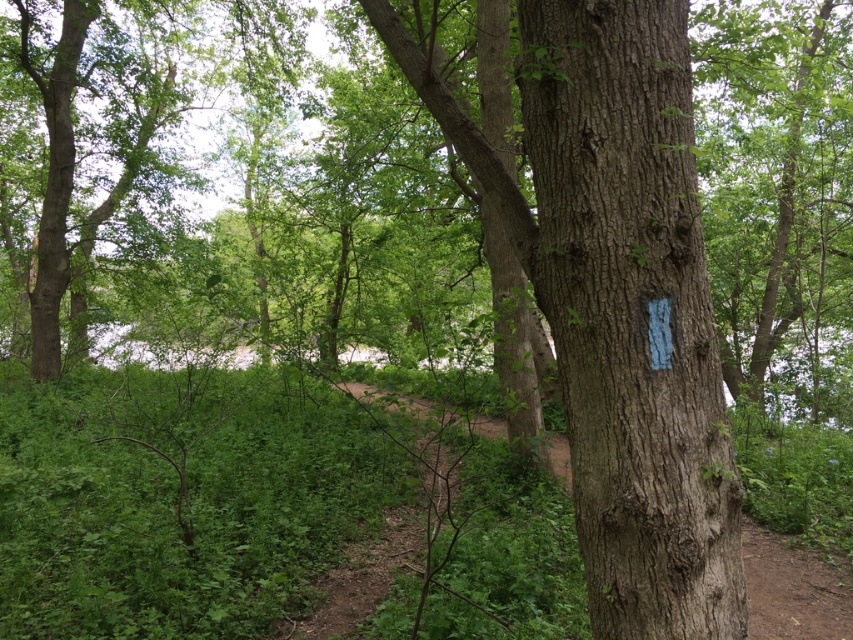
Measure the distance from smooth bark tree trunk at center to smooth bark tree at center.

smooth bark tree trunk at center is 7.58 meters away from smooth bark tree at center.

Who is higher up, smooth bark tree trunk at center or smooth bark tree at center?

smooth bark tree at center is higher up.

The image size is (853, 640). Find the location of `smooth bark tree trunk at center`. smooth bark tree trunk at center is located at coordinates (631, 314).